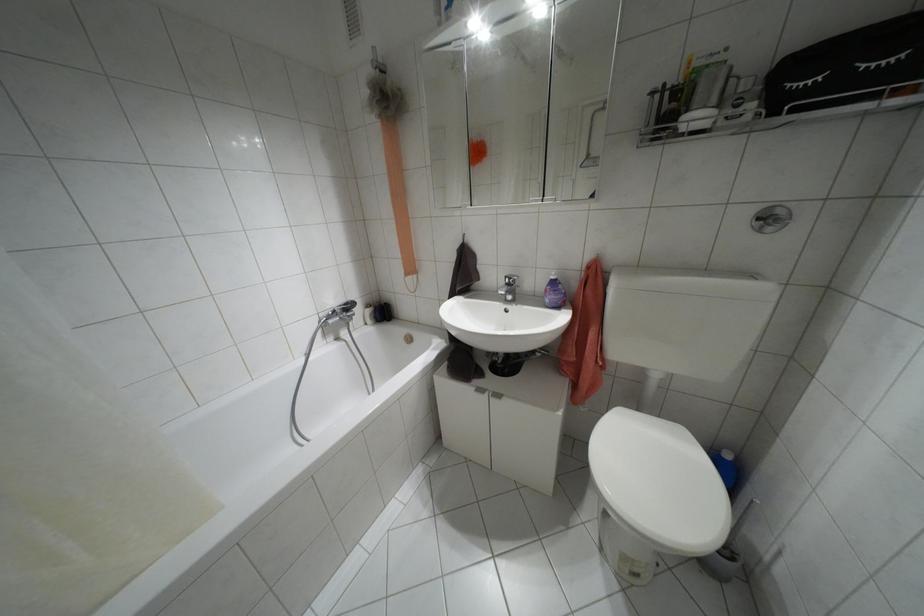
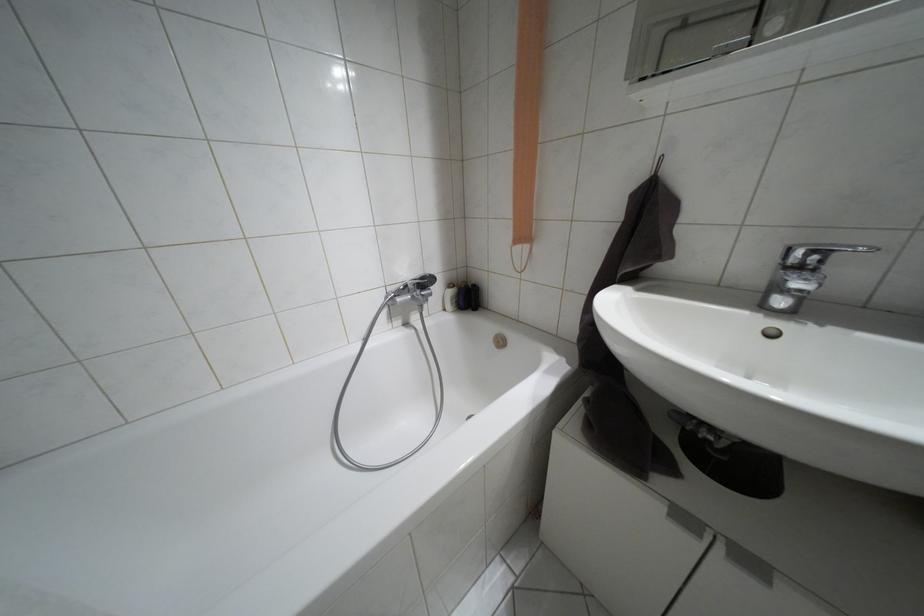
The images are taken continuously from a first-person perspective. In which direction are you moving?

The cameraman walked toward left, forward.